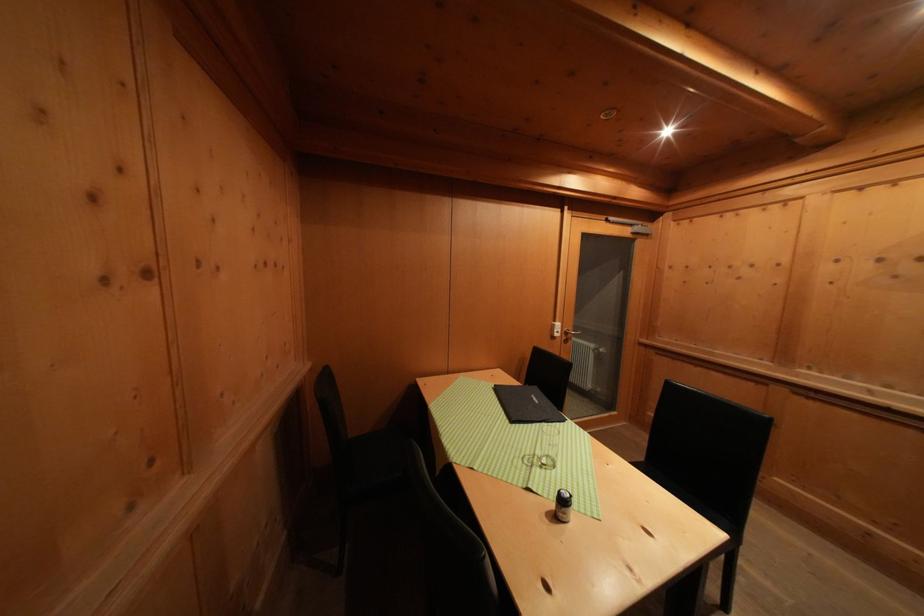
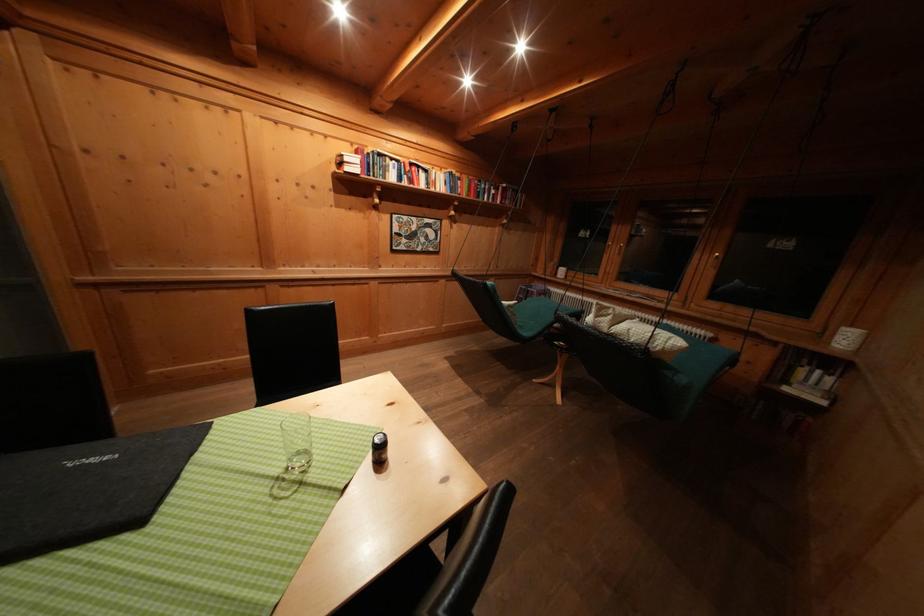
The first image is from the beginning of the video and the second image is from the end. How did the camera likely rotate when shooting the video?

The camera's rotation is toward right-down.